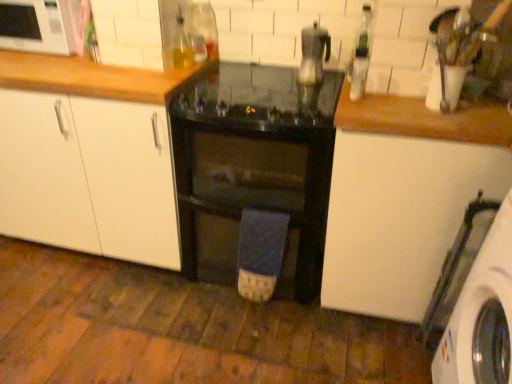
This screenshot has height=384, width=512. Describe the element at coordinates (313, 54) in the screenshot. I see `satin silver coffee maker at center` at that location.

This screenshot has height=384, width=512. What do you see at coordinates (131, 33) in the screenshot?
I see `white matte cabinet at upper center, the 2th cabinetry in the right-to-left sequence` at bounding box center [131, 33].

In order to face white matte cabinet at upper center, the 2th cabinetry in the right-to-left sequence, should I rotate leftwards or rightwards?

It's best to rotate left around 16.386 degrees.

What do you see at coordinates (88, 176) in the screenshot? I see `white matte cabinet at center, the 3th cabinetry positioned from the right` at bounding box center [88, 176].

You are a GUI agent. You are given a task and a screenshot of the screen. Output one action in this format:
    pyautogui.click(x=<x>, y=<y>)
    Task: Click on the black glass gas stove at center
    This screenshot has height=384, width=512.
    Given the screenshot: What is the action you would take?
    pyautogui.click(x=257, y=98)

Find the location of `blue cotton bath towel at center`. blue cotton bath towel at center is located at coordinates (260, 253).

Is white matte cabinet at center, marked as the 1th cabinetry in a left-to-right arrangement, wider than white glossy washing machine at lower right?

Indeed, white matte cabinet at center, marked as the 1th cabinetry in a left-to-right arrangement, has a greater width compared to white glossy washing machine at lower right.

Is white matte cabinet at center, the 3th cabinetry positioned from the right, facing away from white glossy washing machine at lower right?

No, white matte cabinet at center, the 3th cabinetry positioned from the right, is not facing the opposite direction of white glossy washing machine at lower right.

In the scene shown: Is white matte cabinet at center, marked as the 1th cabinetry in a left-to-right arrangement, beside white glossy washing machine at lower right?

white matte cabinet at center, marked as the 1th cabinetry in a left-to-right arrangement, is not next to white glossy washing machine at lower right, and they're not touching.

Is white matte cabinet at center, marked as the 1th cabinetry in a left-to-right arrangement, shorter than white glossy washing machine at lower right?

Yes, white matte cabinet at center, marked as the 1th cabinetry in a left-to-right arrangement, is shorter than white glossy washing machine at lower right.

This screenshot has width=512, height=384. In the image, there is a black glass microwave at center. Find the location of `cabinetry below it (from the image's perspective)`. cabinetry below it (from the image's perspective) is located at coordinates (399, 218).

Is black glass microwave at center shorter than white matte cabinet at upper right, positioned as the 1th cabinetry in right-to-left order?

Indeed, black glass microwave at center has a lesser height compared to white matte cabinet at upper right, positioned as the 1th cabinetry in right-to-left order.

Is black glass microwave at center to the left or to the right of white matte cabinet at upper right, positioned as the 1th cabinetry in right-to-left order, in the image?

In the image, black glass microwave at center appears on the left side of white matte cabinet at upper right, positioned as the 1th cabinetry in right-to-left order.

Based on the photo, is black glass microwave at center next to white matte cabinet at upper right, the third cabinetry positioned from the left?

black glass microwave at center and white matte cabinet at upper right, the third cabinetry positioned from the left, are clearly separated.

Find the location of `bottle that is the 1st one when counting downward from the translucent plastic bottle at center, the second bottle viewed from the left (from the image's perspective)`. bottle that is the 1st one when counting downward from the translucent plastic bottle at center, the second bottle viewed from the left (from the image's perspective) is located at coordinates (361, 56).

Does green glass bottle at upper right, which is the 3th bottle from left to right, turn towards translucent plastic bottle at center, the second bottle viewed from the left?

Yes, green glass bottle at upper right, which is the 3th bottle from left to right, faces towards translucent plastic bottle at center, the second bottle viewed from the left.

From a real-world perspective, who is located lower, green glass bottle at upper right, marked as the 1th bottle in a right-to-left arrangement, or translucent plastic bottle at center, the second bottle viewed from the left?

translucent plastic bottle at center, the second bottle viewed from the left, from a real-world perspective.

Considering the relative positions of green glass bottle at upper right, marked as the 1th bottle in a right-to-left arrangement, and translucent plastic bottle at center, which appears as the 2th bottle when viewed from the right, in the image provided, is green glass bottle at upper right, marked as the 1th bottle in a right-to-left arrangement, to the left of translucent plastic bottle at center, which appears as the 2th bottle when viewed from the right, from the viewer's perspective?

No.

Is green glass bottle at upper right, which is the 3th bottle from left to right, at the right side of white matte cabinet at upper right, positioned as the 1th cabinetry in right-to-left order?

In fact, green glass bottle at upper right, which is the 3th bottle from left to right, is to the left of white matte cabinet at upper right, positioned as the 1th cabinetry in right-to-left order.

Identify the location of the 1st bottle to the left when counting from the white matte cabinet at upper right, the third cabinetry positioned from the left. (361, 56).

Is there a large distance between green glass bottle at upper right, which is the 3th bottle from left to right, and white matte cabinet at upper right, positioned as the 1th cabinetry in right-to-left order?

No, green glass bottle at upper right, which is the 3th bottle from left to right, is not far away from white matte cabinet at upper right, positioned as the 1th cabinetry in right-to-left order.

Considering the sizes of satin silver coffee maker at center and black glass microwave at center in the image, is satin silver coffee maker at center taller or shorter than black glass microwave at center?

satin silver coffee maker at center is shorter than black glass microwave at center.

Does point (321, 37) lie in front of point (328, 196)?

That is False.

Considering the relative positions of satin silver coffee maker at center and black glass microwave at center in the image provided, is satin silver coffee maker at center to the left of black glass microwave at center from the viewer's perspective?

No.

Which object is further away from the camera taking this photo, blue cotton bath towel at center or white matte cabinet at upper center, the 2th cabinetry in the right-to-left sequence?

blue cotton bath towel at center.

Can you confirm if blue cotton bath towel at center is positioned to the right of white matte cabinet at upper center, the 2th cabinetry in the right-to-left sequence?

Correct, you'll find blue cotton bath towel at center to the right of white matte cabinet at upper center, the 2th cabinetry in the right-to-left sequence.

Is blue cotton bath towel at center oriented away from white matte cabinet at upper center, the 2th cabinetry in the right-to-left sequence?

blue cotton bath towel at center is not turned away from white matte cabinet at upper center, the 2th cabinetry in the right-to-left sequence.

Are blue cotton bath towel at center and white matte cabinet at upper center, positioned as the second cabinetry in left-to-right order, far apart?

No.

In the scene shown: Looking at their sizes, would you say black glass gas stove at center is wider or thinner than translucent plastic bottle at center, which appears as the 2th bottle when viewed from the right?

black glass gas stove at center is wider than translucent plastic bottle at center, which appears as the 2th bottle when viewed from the right.

Can you tell me how much black glass gas stove at center and translucent plastic bottle at center, which appears as the 2th bottle when viewed from the right, differ in facing direction?

The facing directions of black glass gas stove at center and translucent plastic bottle at center, which appears as the 2th bottle when viewed from the right, are 89.4 degrees apart.

Considering the sizes of objects black glass gas stove at center and translucent plastic bottle at center, the second bottle viewed from the left, in the image provided, who is smaller, black glass gas stove at center or translucent plastic bottle at center, the second bottle viewed from the left,?

With smaller size is translucent plastic bottle at center, the second bottle viewed from the left.

Is black glass gas stove at center situated inside translucent plastic bottle at center, which appears as the 2th bottle when viewed from the right, or outside?

black glass gas stove at center is outside translucent plastic bottle at center, which appears as the 2th bottle when viewed from the right.

Starting from the white glossy washing machine at lower right, which cabinetry is the 2nd one behind? Please provide its 2D coordinates.

[(88, 176)]

You are a GUI agent. You are given a task and a screenshot of the screen. Output one action in this format:
    pyautogui.click(x=<x>, y=<y>)
    Task: Click on the cabinetry that is the 2nd one above the black glass microwave at center (from a real-world perspective)
    The width and height of the screenshot is (512, 384).
    Given the screenshot: What is the action you would take?
    pyautogui.click(x=399, y=218)

From the image, which object appears to be nearer to white matte cabinet at center, marked as the 1th cabinetry in a left-to-right arrangement, white glossy microwave at upper left or black glass gas stove at center?

white glossy microwave at upper left lies closer to white matte cabinet at center, marked as the 1th cabinetry in a left-to-right arrangement, than the other object.

Looking at the image, which one is located further to white glossy microwave at upper left, black glass gas stove at center or translucent glass bottle at upper center, the first bottle from the left?

black glass gas stove at center is further to white glossy microwave at upper left.

Based on their spatial positions, is black glass microwave at center or white matte cabinet at upper center, positioned as the second cabinetry in left-to-right order, further from white glossy microwave at upper left?

Based on the image, black glass microwave at center appears to be further to white glossy microwave at upper left.

From the image, which object appears to be nearer to translucent plastic bottle at center, which appears as the 2th bottle when viewed from the right, white glossy microwave at upper left or black glass gas stove at center?

black glass gas stove at center is closer to translucent plastic bottle at center, which appears as the 2th bottle when viewed from the right.

Looking at the image, which one is located closer to white matte cabinet at upper right, the third cabinetry positioned from the left, black glass gas stove at center or translucent plastic bottle at center, the second bottle viewed from the left?

black glass gas stove at center lies closer to white matte cabinet at upper right, the third cabinetry positioned from the left, than the other object.

In the scene shown: From the image, which object appears to be farther from translucent glass bottle at upper center, the first bottle from the left, white matte cabinet at upper center, positioned as the second cabinetry in left-to-right order, or black glass gas stove at center?

The object further to translucent glass bottle at upper center, the first bottle from the left, is black glass gas stove at center.

Estimate the real-world distances between objects in this image. Which object is closer to blue cotton bath towel at center, black glass gas stove at center or white glossy microwave at upper left?

Based on the image, black glass gas stove at center appears to be nearer to blue cotton bath towel at center.

Based on their spatial positions, is translucent glass bottle at upper center, the first bottle from the left, or white matte cabinet at upper center, positioned as the second cabinetry in left-to-right order, closer to translucent plastic bottle at center, the second bottle viewed from the left?

translucent glass bottle at upper center, the first bottle from the left, is closer to translucent plastic bottle at center, the second bottle viewed from the left.

Locate an element on the screen. Image resolution: width=512 pixels, height=384 pixels. home appliance located between white matte cabinet at upper center, positioned as the second cabinetry in left-to-right order, and black glass gas stove at center in the left-right direction is located at coordinates (255, 178).

You are a GUI agent. You are given a task and a screenshot of the screen. Output one action in this format:
    pyautogui.click(x=<x>, y=<y>)
    Task: Click on the appliance located between white glossy microwave at upper left and white glossy washing machine at lower right in the left-right direction
    This screenshot has width=512, height=384.
    Given the screenshot: What is the action you would take?
    pyautogui.click(x=313, y=54)

Where is `bath towel situated between white matte cabinet at center, the 3th cabinetry positioned from the right, and black glass microwave at center from left to right`? Image resolution: width=512 pixels, height=384 pixels. bath towel situated between white matte cabinet at center, the 3th cabinetry positioned from the right, and black glass microwave at center from left to right is located at coordinates (260, 253).

The height and width of the screenshot is (384, 512). In order to click on bath towel between translucent plastic bottle at center, which appears as the 2th bottle when viewed from the right, and white glossy washing machine at lower right vertically in this screenshot , I will do `click(260, 253)`.